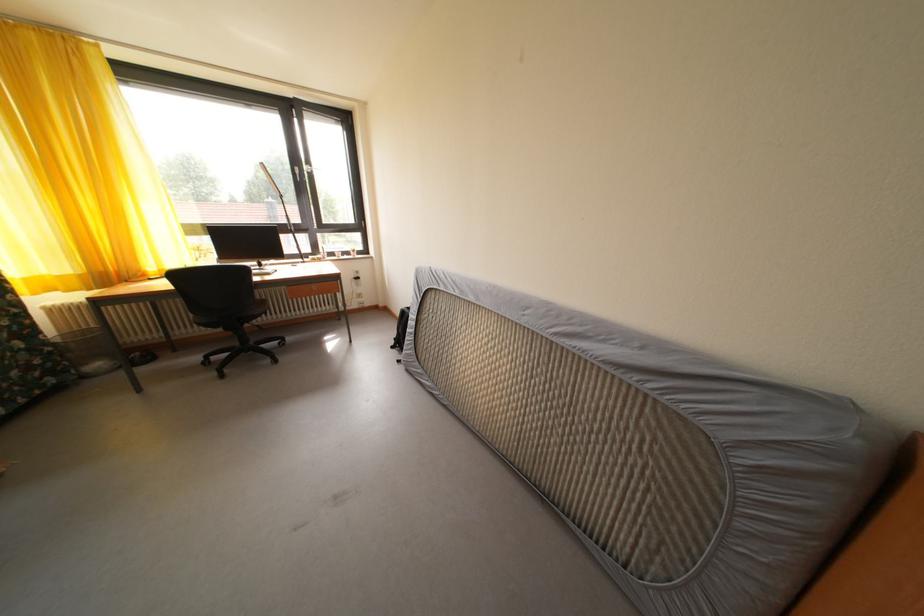
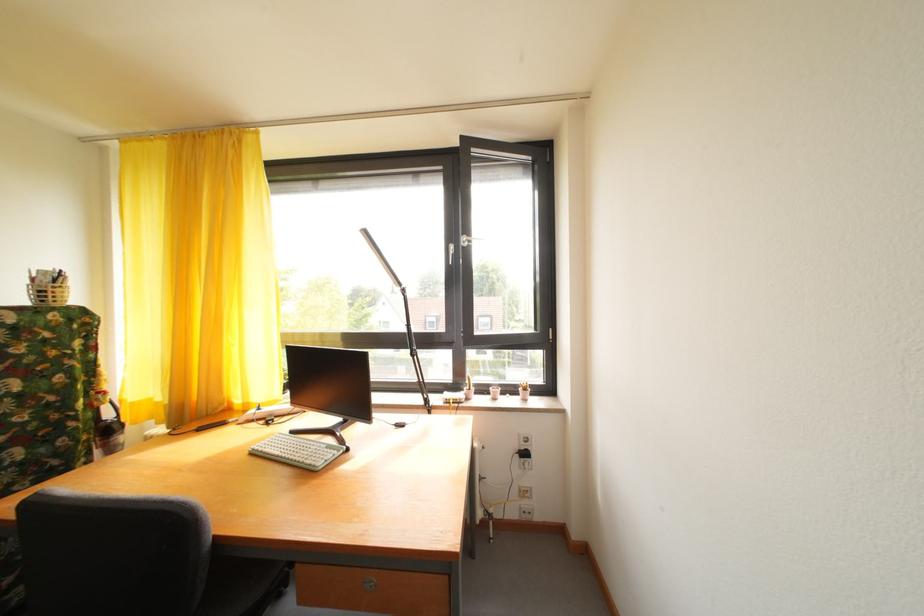
Question: I am providing you with two images of the same scene from different viewpoints. Please identify which objects are invisible in image2.

Choices:
 (A) keyboard
 (B) drawer lock
 (C) black desk lamp
 (D) none of these

Answer: (D)